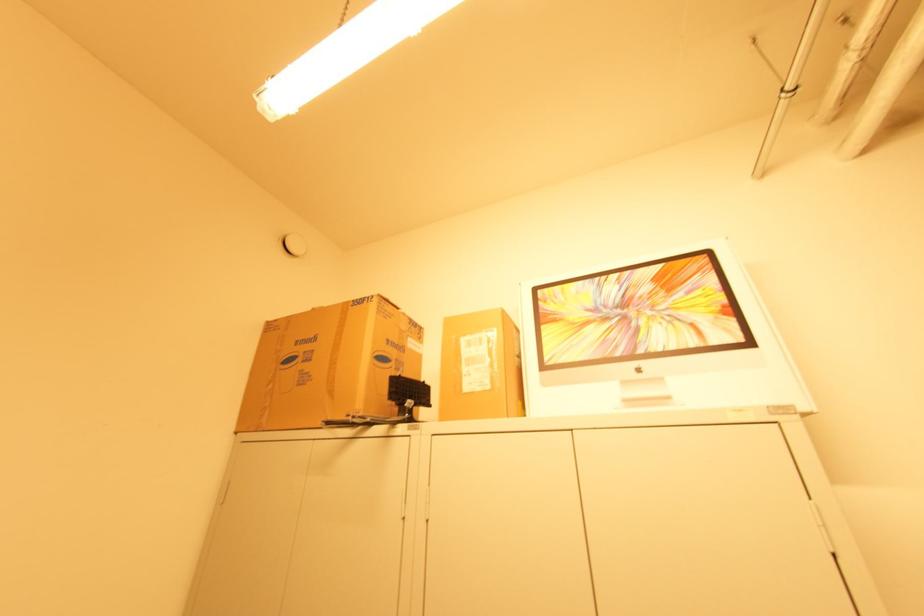
In order to click on large cardboard box in this screenshot , I will do `click(329, 363)`.